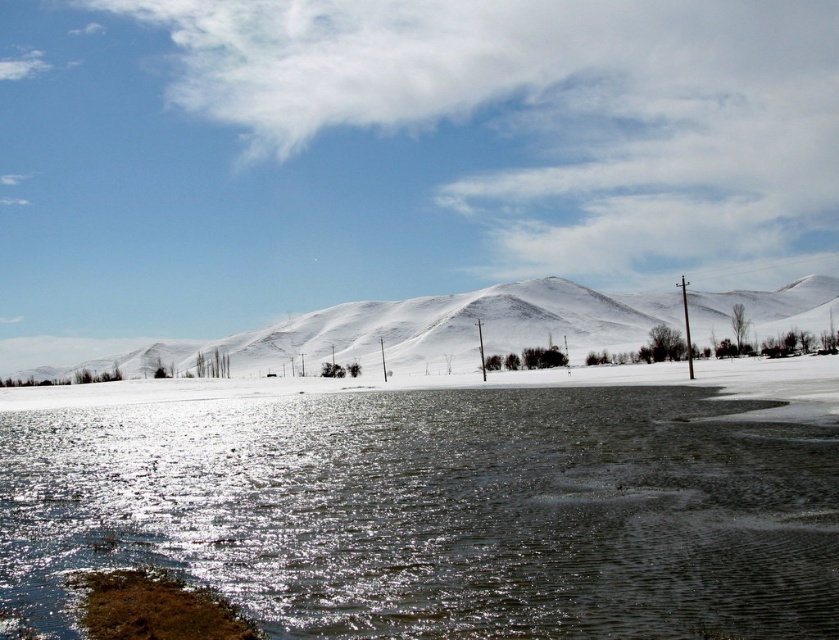
Does translucent ice at lower center have a lesser height compared to white snow-covered mountain at center?

Yes.

Does translucent ice at lower center have a smaller size compared to white snow-covered mountain at center?

Indeed, translucent ice at lower center has a smaller size compared to white snow-covered mountain at center.

Where is `translucent ice at lower center`? translucent ice at lower center is located at coordinates pos(435,512).